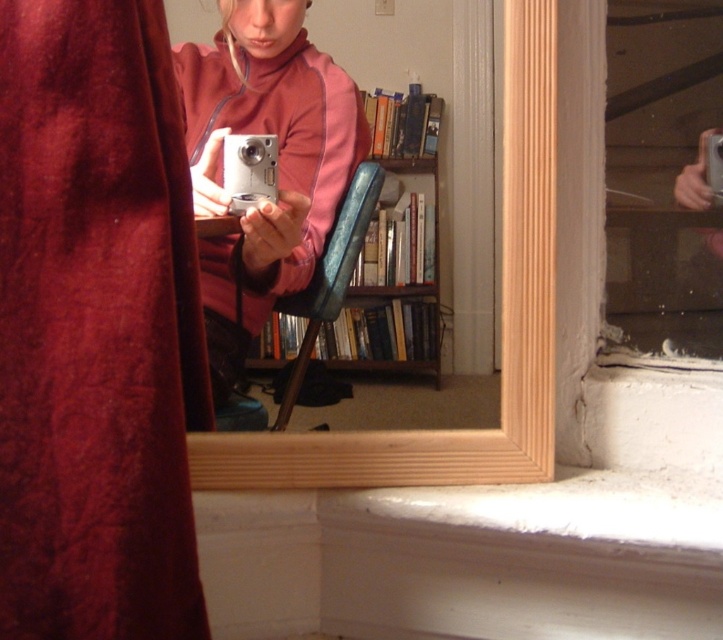
Is pink fabric at center taller than silver metallic camera at upper right?

Indeed, pink fabric at center has a greater height compared to silver metallic camera at upper right.

Is pink fabric at center below silver metallic camera at upper right?

No.

The width and height of the screenshot is (723, 640). What are the coordinates of `pink fabric at center` in the screenshot? It's located at click(x=278, y=163).

Describe the element at coordinates (95, 326) in the screenshot. The image size is (723, 640). I see `velvet-like burgundy curtain at left` at that location.

Which is in front, point (35, 540) or point (625, 216)?

Positioned in front is point (35, 540).

Locate an element on the screen. The height and width of the screenshot is (640, 723). velvet-like burgundy curtain at left is located at coordinates (95, 326).

Between pink fabric at center and wooden bookshelf at center, which one is positioned lower?

wooden bookshelf at center is below.

Does pink fabric at center come in front of wooden bookshelf at center?

Yes, it is.

Between point (320, 216) and point (416, 296), which one is positioned behind?

Point (320, 216)

Identify the location of pink fabric at center. The height and width of the screenshot is (640, 723). (278, 163).